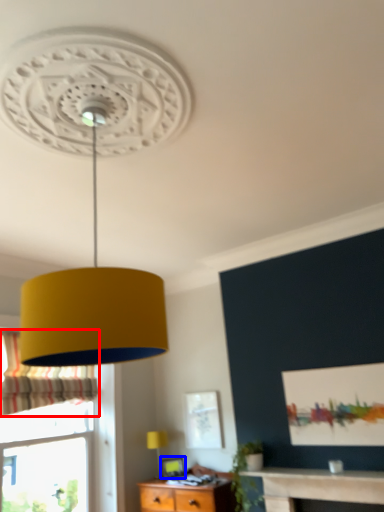
Question: Which point is further to the camera, curtain (highlighted by a red box) or picture frame (highlighted by a blue box)?

Choices:
 (A) curtain
 (B) picture frame

Answer: (B)